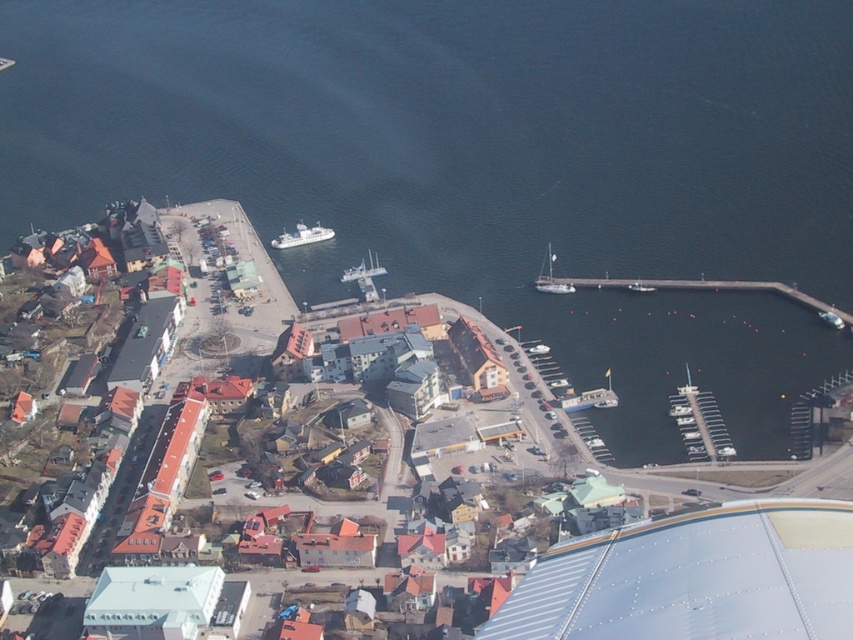
Question: Which of the following is the farthest from the observer?

Choices:
 (A) (546, 346)
 (B) (20, 157)
 (C) (552, 260)

Answer: (B)

Question: Among these objects, which one is farthest from the camera?

Choices:
 (A) white matte sailboat at center-right
 (B) white matte ship at center
 (C) dark blue water at center

Answer: (B)

Question: Considering the relative positions of dark blue water at center and white plastic boat at center in the image provided, where is dark blue water at center located with respect to white plastic boat at center?

Choices:
 (A) right
 (B) left

Answer: (B)

Question: Among these objects, which one is farthest from the camera?

Choices:
 (A) white matte sailboat at center-right
 (B) white matte ship at center

Answer: (B)

Question: Is white matte ship at center positioned before white plastic boat at center?

Choices:
 (A) yes
 (B) no

Answer: (B)

Question: Can you confirm if dark blue water at center is wider than white glossy boat at center?

Choices:
 (A) no
 (B) yes

Answer: (B)